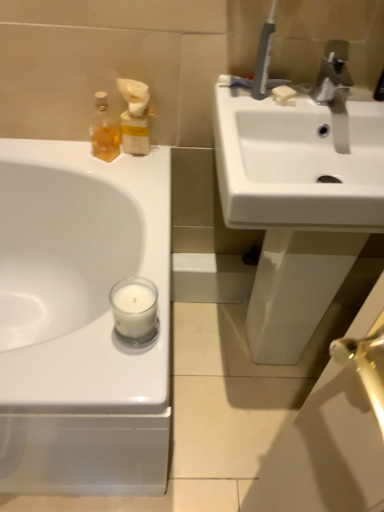
Question: From the image's perspective, is translucent glass bottle at upper left above or below white matte soap at upper right?

Choices:
 (A) above
 (B) below

Answer: (B)

Question: From a real-world perspective, is translucent glass bottle at upper left above or below white matte soap at upper right?

Choices:
 (A) above
 (B) below

Answer: (B)

Question: Which of these objects is positioned farthest from the white glossy sink at upper left, the first sink from the left?

Choices:
 (A) silver metallic faucet at upper right
 (B) white matte soap at upper right
 (C) white matte glass candle at lower center
 (D) white glossy sink at upper right, the 1th sink when ordered from right to left
 (E) translucent glass bottle at upper left

Answer: (A)

Question: Based on their relative distances, which object is farther from the white glossy sink at upper right, which is the second sink in left-to-right order?

Choices:
 (A) white matte soap at upper right
 (B) translucent glass bottle at upper left
 (C) white glossy sink at upper left, placed as the 2th sink when sorted from right to left
 (D) white matte glass candle at lower center
 (E) silver metallic faucet at upper right

Answer: (B)